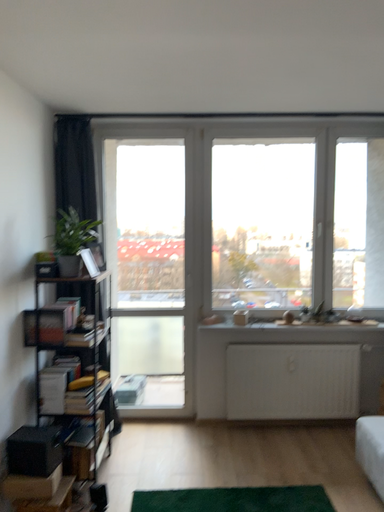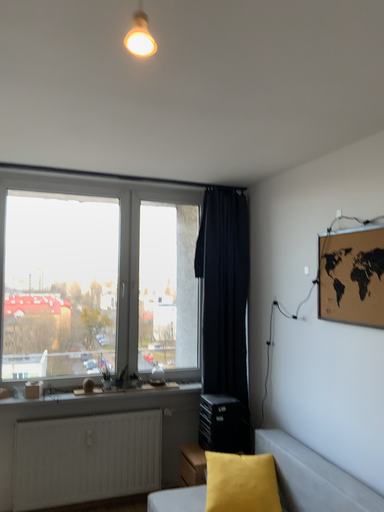
Question: Which way did the camera rotate in the video?

Choices:
 (A) rotated left
 (B) rotated right

Answer: (B)